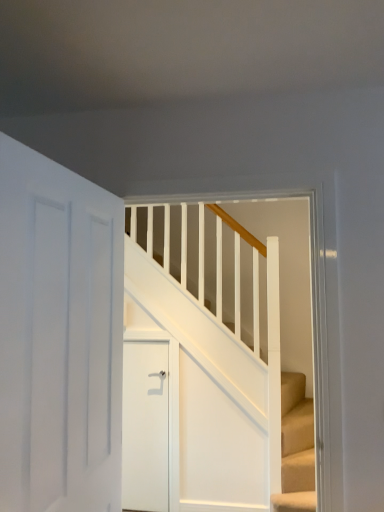
Question: Is white wooden stairs at center taller or shorter than white matte door at center, positioned as the second door in front-to-back order?

Choices:
 (A) short
 (B) tall

Answer: (B)

Question: Is white wooden stairs at center in front of or behind white matte door at center, positioned as the second door in front-to-back order, in the image?

Choices:
 (A) behind
 (B) front

Answer: (B)

Question: Estimate the real-world distances between objects in this image. Which object is closer to the white wooden stairs at center?

Choices:
 (A) white matte door at center, positioned as the second door in front-to-back order
 (B) white matte door at left, which appears as the second door when viewed from the back

Answer: (A)

Question: Estimate the real-world distances between objects in this image. Which object is farther from the white matte door at left, which appears as the second door when viewed from the back?

Choices:
 (A) white wooden stairs at center
 (B) white matte door at center, the first door from the back

Answer: (B)